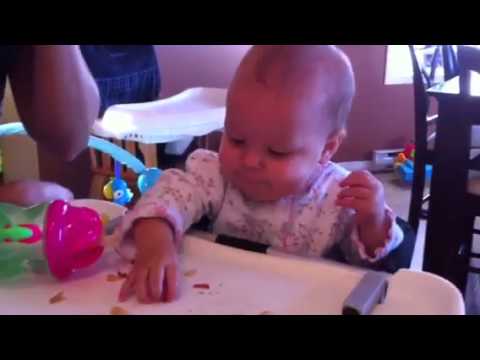
I want to click on window, so (x=404, y=62), (x=297, y=335).